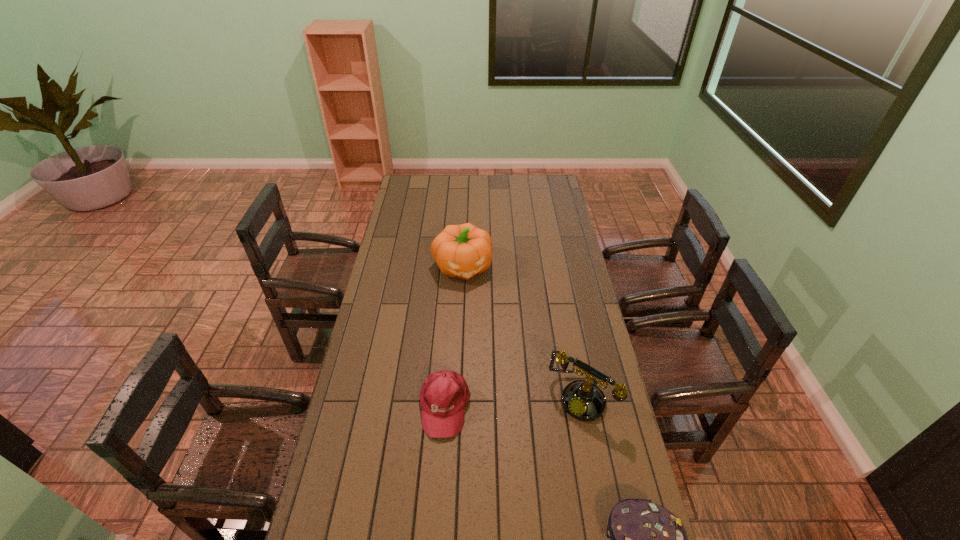
Find the location of a particular element. The image size is (960, 540). vacant space on the desktop that is between the baseball cap and the nearest object and is positioned on the carved face of the farthest object is located at coordinates (510, 449).

The height and width of the screenshot is (540, 960). Identify the location of vacant spot on the desktop that is between the baseball cap and the headwear and is positioned on the dial of the telephone. (535, 465).